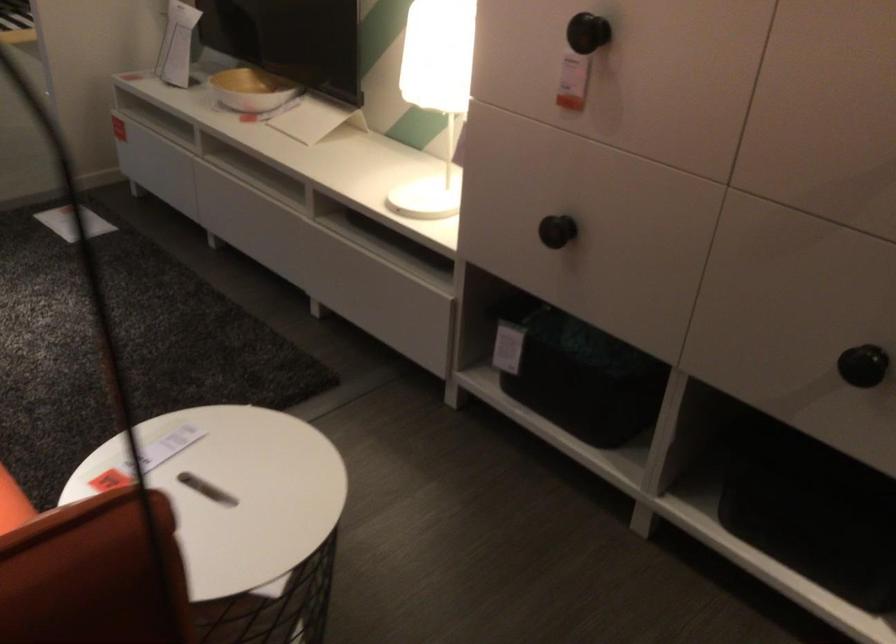
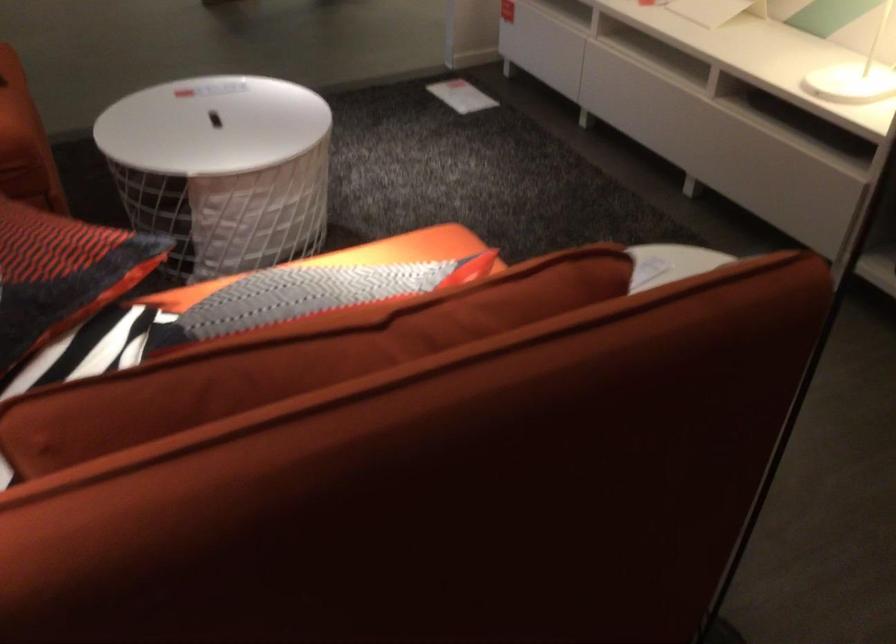
Question: How did the camera likely rotate?

Choices:
 (A) Left
 (B) Right
 (C) Up
 (D) Down

Answer: (A)